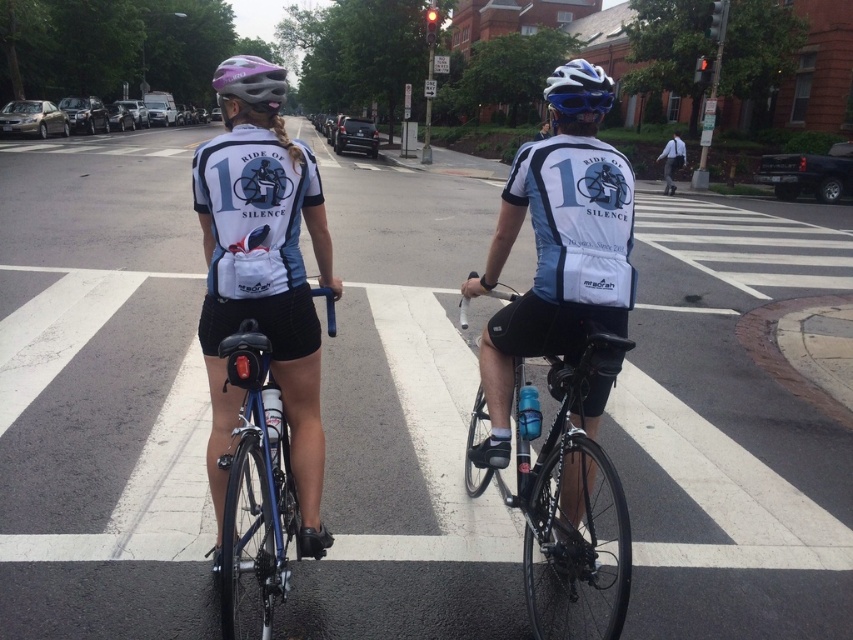
Does purple matte bicycle helmet at upper center appear over gray fabric backpack at upper right?

Yes.

Is point (224, 108) positioned after point (659, 154)?

No, it is not.

I want to click on purple matte bicycle helmet at upper center, so [250, 83].

Is point (222, 625) more distant than point (669, 189)?

That is False.

Who is shorter, blue metallic bicycle at center or gray fabric backpack at upper right?

gray fabric backpack at upper right is shorter.

Who is more distant from viewer, [242,609] or [669,189]?

The point [669,189] is more distant.

Identify the location of blue metallic bicycle at center. This screenshot has height=640, width=853. (254, 493).

Does shiny black frame at center appear on the right side of blue metallic bicycle at center?

Yes, shiny black frame at center is to the right of blue metallic bicycle at center.

Is point (473, 403) positioned behind point (267, 604)?

Yes, it is behind point (267, 604).

I want to click on shiny black frame at center, so click(561, 499).